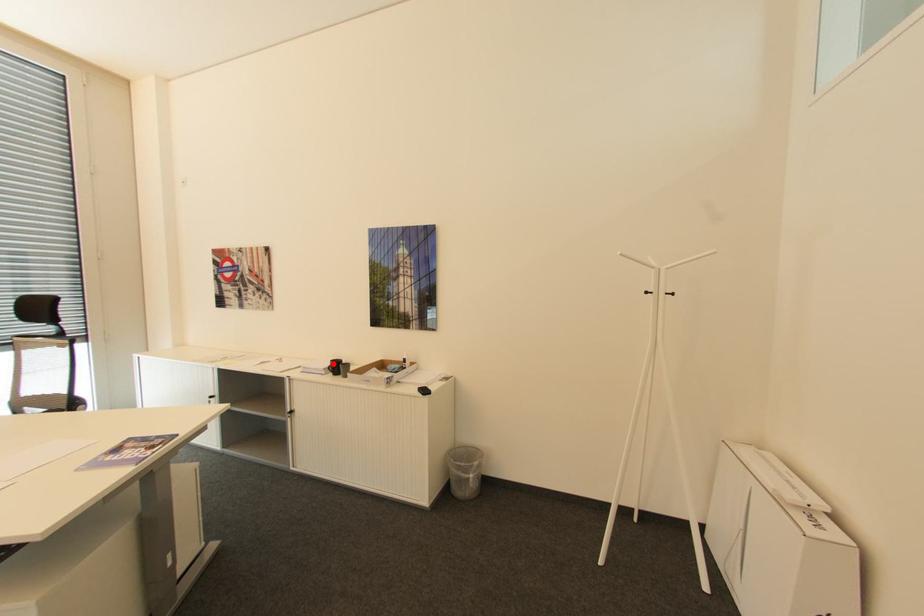
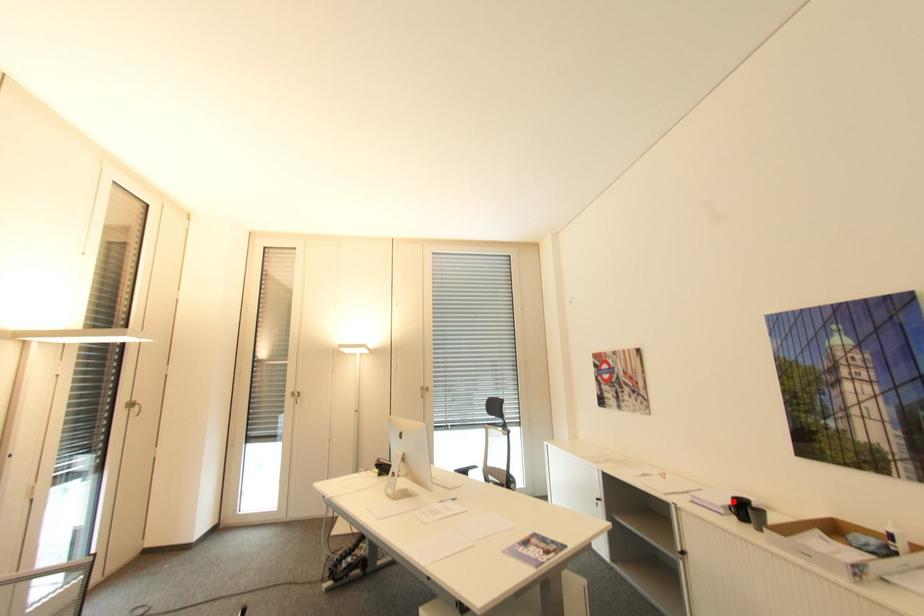
I am providing you with two images of the same scene from different viewpoints. A red point is marked on the first image and another point is marked on the second image. Do the highlighted points in image1 and image2 indicate the same real-world spot?

Yes